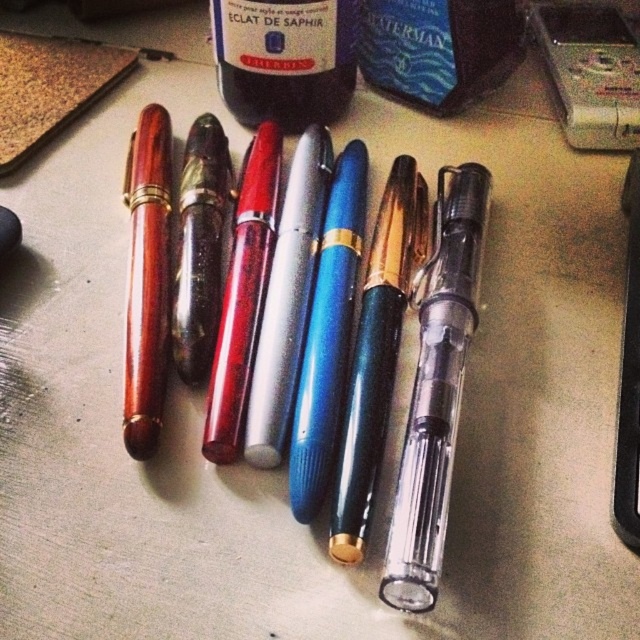
Question: Is translucent glass bottle at center bigger than wooden pen at left?

Choices:
 (A) no
 (B) yes

Answer: (A)

Question: Is translucent glass bottle at center further to camera compared to wooden pen at left?

Choices:
 (A) no
 (B) yes

Answer: (B)

Question: Which point is farther to the camera?

Choices:
 (A) wooden pen at left
 (B) translucent glass bottle at center

Answer: (B)

Question: Which point appears farthest from the camera in this image?

Choices:
 (A) (157, 195)
 (B) (328, 45)

Answer: (B)

Question: Which of the following is the closest to the observer?

Choices:
 (A) (150, 445)
 (B) (227, 0)

Answer: (A)

Question: Observing the image, what is the correct spatial positioning of translucent glass bottle at center in reference to wooden pen at left?

Choices:
 (A) right
 (B) left

Answer: (A)